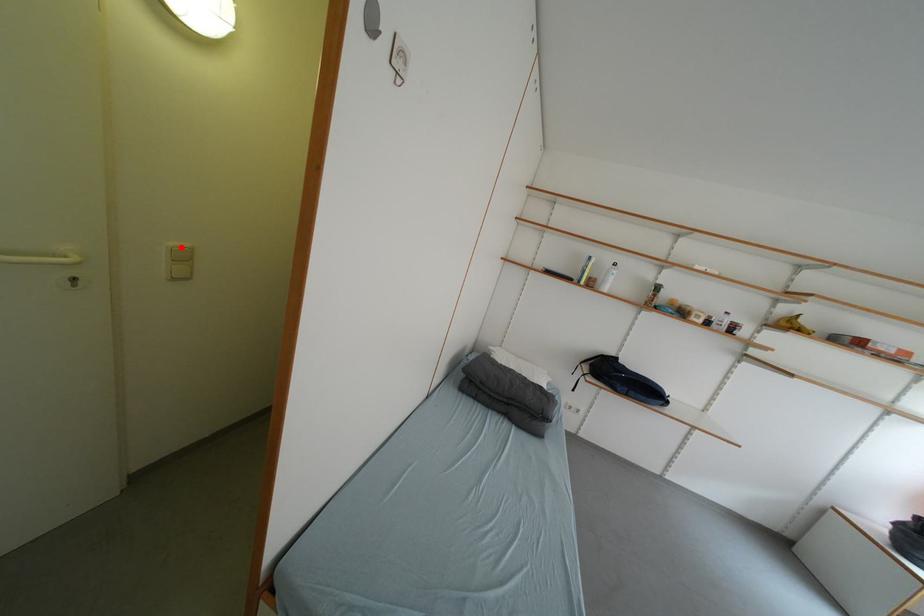
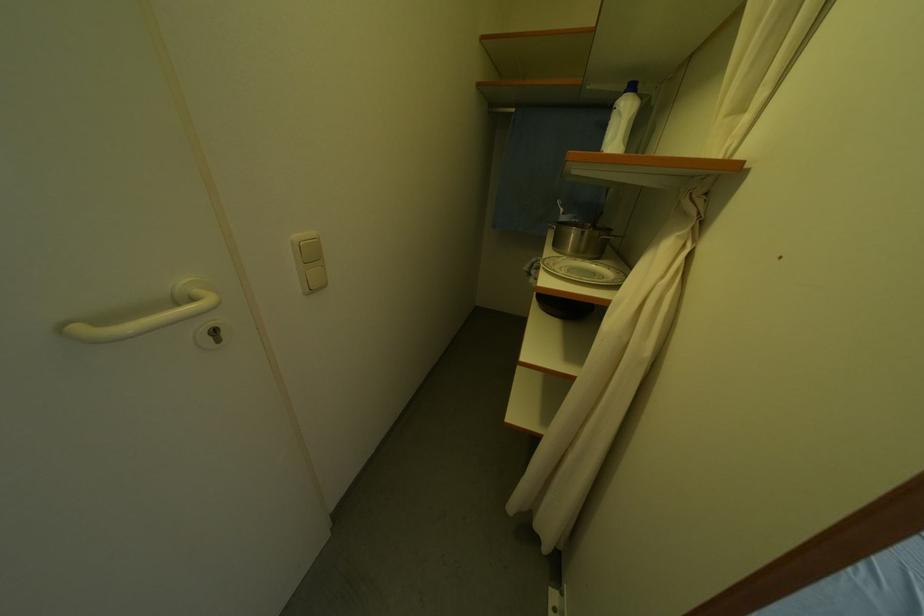
Question: I am providing you with two images of the same scene from different viewpoints. A red point is marked on the first image. At the location where the point appears in image 1, is it still visible in image 2?

Choices:
 (A) Yes
 (B) No

Answer: (A)